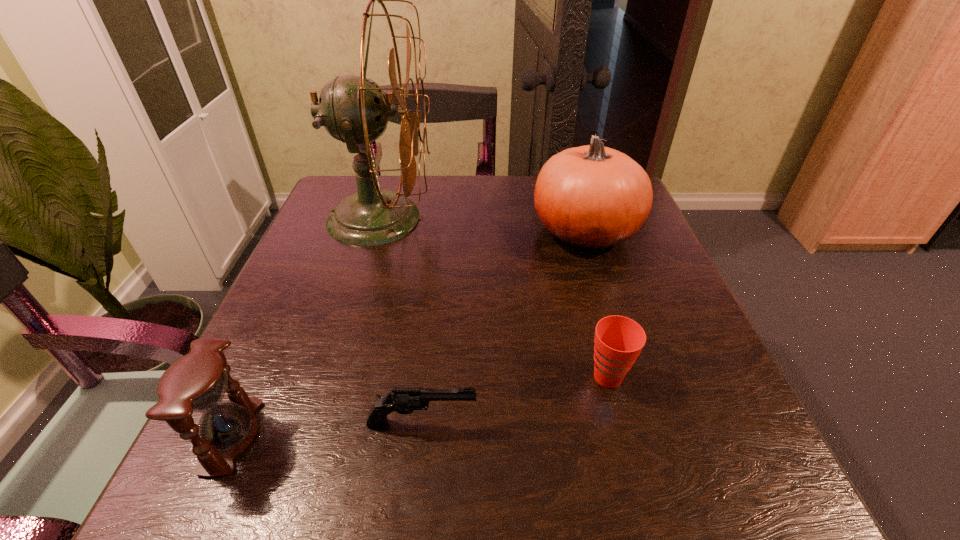
The image size is (960, 540). I want to click on free space between the third tallest object and the gun, so click(327, 429).

Where is `free space that is in between the shortest object and the second shortest object`? The width and height of the screenshot is (960, 540). free space that is in between the shortest object and the second shortest object is located at coordinates (515, 400).

Locate an element on the screen. unoccupied area between the tallest object and the hourglass is located at coordinates (305, 327).

Identify the location of unoccupied position between the hourglass and the shortest object. The height and width of the screenshot is (540, 960). (327, 429).

At what (x,y) coordinates should I click in order to perform the action: click on the fourth closest object relative to the fourth tallest object. Please return your answer as a coordinate pair (x, y). This screenshot has width=960, height=540. Looking at the image, I should click on (196, 383).

Where is `object that is the fourth closest to the hourglass`? The width and height of the screenshot is (960, 540). object that is the fourth closest to the hourglass is located at coordinates (591, 197).

This screenshot has height=540, width=960. I want to click on free space that satisfies the following two spatial constraints: 1. in front of the tallest object, directing air flow; 2. on the left side of the pumpkin, so click(375, 233).

The image size is (960, 540). I want to click on free space that satisfies the following two spatial constraints: 1. in front of the fan, directing air flow; 2. on the left side of the second tallest object, so click(375, 233).

Locate an element on the screen. free spot that satisfies the following two spatial constraints: 1. in front of the fan, directing air flow; 2. on the right side of the pumpkin is located at coordinates (375, 233).

Identify the location of free region that satisfies the following two spatial constraints: 1. in front of the tallest object, directing air flow; 2. on the front side of the third shortest object. The height and width of the screenshot is (540, 960). (312, 436).